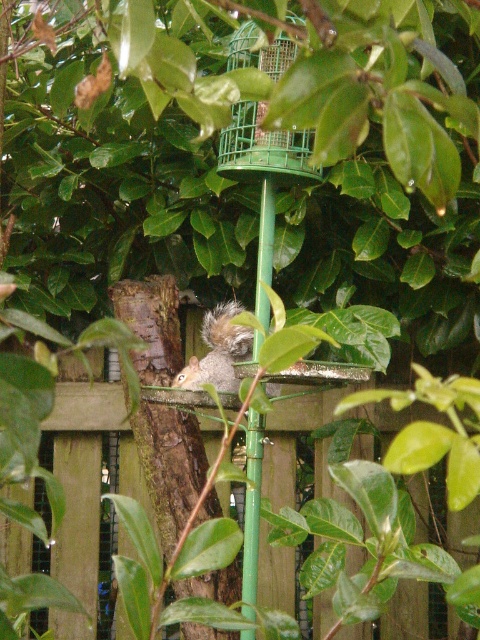
Does wooden fence at center have a greater height compared to green wire mesh bird feeder at center?

Correct, wooden fence at center is much taller as green wire mesh bird feeder at center.

Does wooden fence at center have a greater width compared to green wire mesh bird feeder at center?

Yes.

Locate an element on the screen. The image size is (480, 640). wooden fence at center is located at coordinates (83, 465).

Is wooden fence at center shorter than gray furry squirrel at center?

In fact, wooden fence at center may be taller than gray furry squirrel at center.

Is point (94, 438) positioned after point (228, 326)?

Yes, point (94, 438) is farther from viewer.

The width and height of the screenshot is (480, 640). What are the coordinates of `wooden fence at center` in the screenshot? It's located at (83, 465).

Is brown rough tree trunk at center positioned at the back of gray furry squirrel at center?

Yes, it is behind gray furry squirrel at center.

Which of these two, brown rough tree trunk at center or gray furry squirrel at center, stands shorter?

gray furry squirrel at center is shorter.

This screenshot has height=640, width=480. I want to click on brown rough tree trunk at center, so click(169, 465).